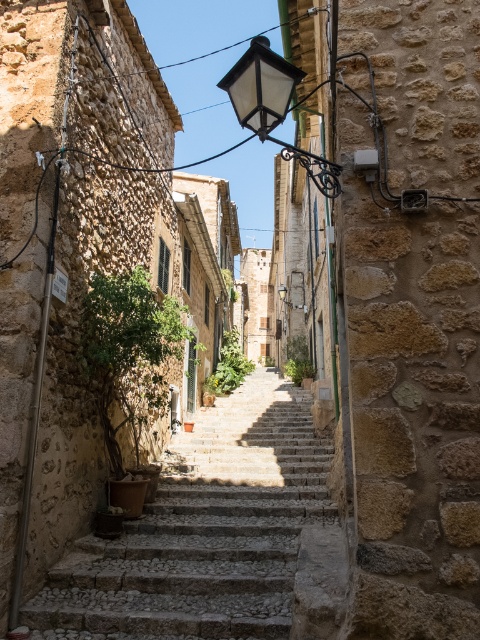
You are standing at the entrance of the narrow street and want to reach the top of the stone textured stairs at center. Which direction should you walk to approach the stairs directly?

You should walk forward towards the stone textured stairs at center since they are located at the center of the street directly ahead of you.

You are a tourist standing at the bottom of the street and want to reach the top. The stone textured stairs at center and the matte glass streetlamp at upper center are in your path. Which object is taller, and does this affect your ability to climb the stairs?

The matte glass streetlamp at upper center is taller than the stone textured stairs at center. This does not affect your ability to climb the stairs since the height of the streetlamp does not block the path.

You are a tourist standing at the entrance of the street and want to take a photo of both the stone textured stairs at center and the matte glass streetlamp at upper center. Which object should you focus on first to ensure both are in the frame?

You should focus on the stone textured stairs at center first because it is closer to you than the matte glass streetlamp at upper center, so adjusting your camera to include the closer object will naturally include the farther one as well.